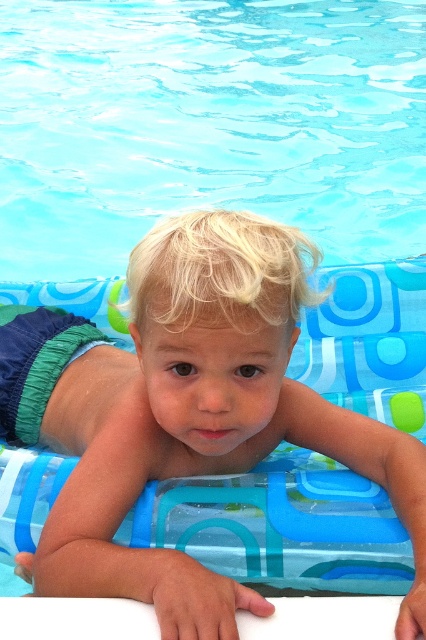
You are designing a safety barrier around the transparent plastic pool at upper center and the blonde hair toddler at center. To ensure the barrier is wide enough to safely contain the toddler, which object should determine the barrier width?

The barrier should be designed based on the width of the transparent plastic pool at upper center since it might be wider than the blonde hair toddler at center.

You are a lifeguard on duty and notice the transparent plastic pool at upper center and the blonde hair toddler at center. According to the safety guidelines, the pool must be positioned so that it does not obstruct the lifeguard view of the toddler. Does the current arrangement comply with this rule?

The transparent plastic pool at upper center is above the blonde hair toddler at center, which means it is blocking the lifeguard view of the toddler. This arrangement does not comply with safety guidelines.

From the picture: You are a lifeguard standing at the edge of the pool. You need to locate the transparent plastic pool at upper center. Where exactly is it located in terms of coordinates?

The transparent plastic pool at upper center is located at coordinates point (207, 124).